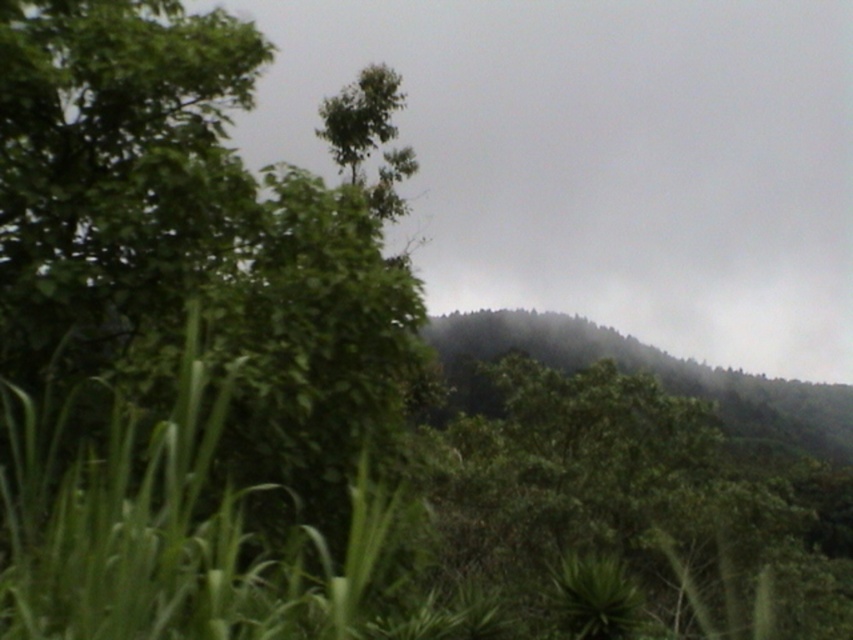
Question: Is green leafy tree at upper left thinner than dark green forest at center?

Choices:
 (A) yes
 (B) no

Answer: (A)

Question: Based on their relative distances, which object is nearer to the green leafy cloud at upper center?

Choices:
 (A) green leafy tree at upper left
 (B) dark green forest at center

Answer: (B)

Question: Can you confirm if green leafy cloud at upper center is smaller than dark green forest at center?

Choices:
 (A) yes
 (B) no

Answer: (B)

Question: Which object appears farthest from the camera in this image?

Choices:
 (A) green leafy cloud at upper center
 (B) dark green forest at center

Answer: (B)

Question: Observing the image, what is the correct spatial positioning of green leafy cloud at upper center in reference to green leafy tree at upper left?

Choices:
 (A) below
 (B) above

Answer: (B)

Question: Which is nearer to the dark green forest at center?

Choices:
 (A) green leafy tree at upper left
 (B) green leafy cloud at upper center

Answer: (B)